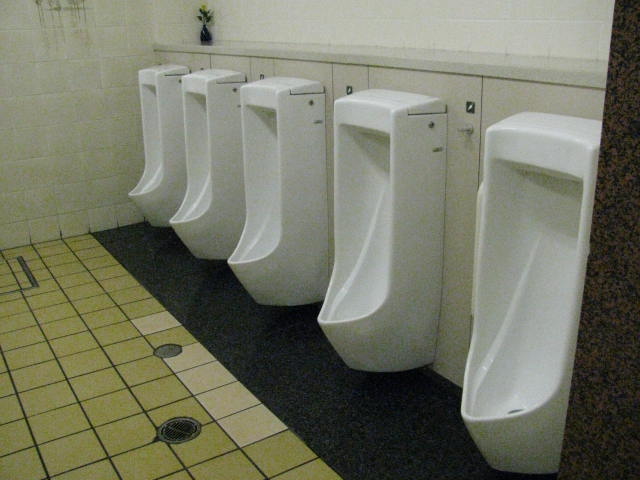
The height and width of the screenshot is (480, 640). I want to click on urinal in the bathroom, so click(157, 126), click(195, 133), click(258, 149), click(351, 179), click(500, 232).